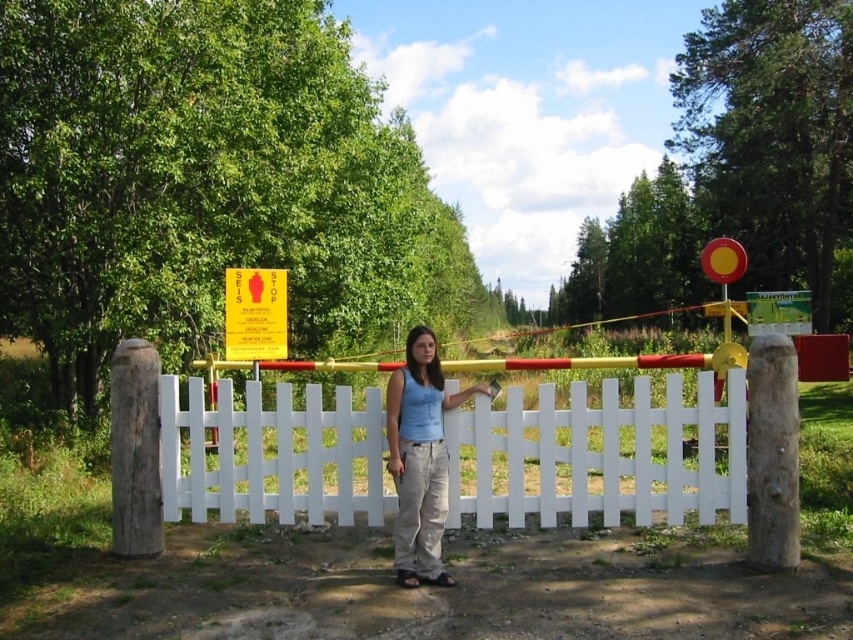
Question: Which object is the farthest from the light blue cotton shirt at center?

Choices:
 (A) yellow plastic sign at upper center
 (B) white wooden fence at center

Answer: (A)

Question: Can you confirm if white wooden fence at center is bigger than yellow plastic sign at upper center?

Choices:
 (A) no
 (B) yes

Answer: (B)

Question: Which point is closer to the camera?

Choices:
 (A) (426, 572)
 (B) (257, 340)

Answer: (A)

Question: Which of the following is the farthest from the observer?

Choices:
 (A) light blue cotton shirt at center
 (B) white wooden fence at center

Answer: (B)

Question: Is white wooden fence at center bigger than yellow plastic sign at upper center?

Choices:
 (A) yes
 (B) no

Answer: (A)

Question: Is white wooden fence at center in front of light blue cotton shirt at center?

Choices:
 (A) yes
 (B) no

Answer: (B)